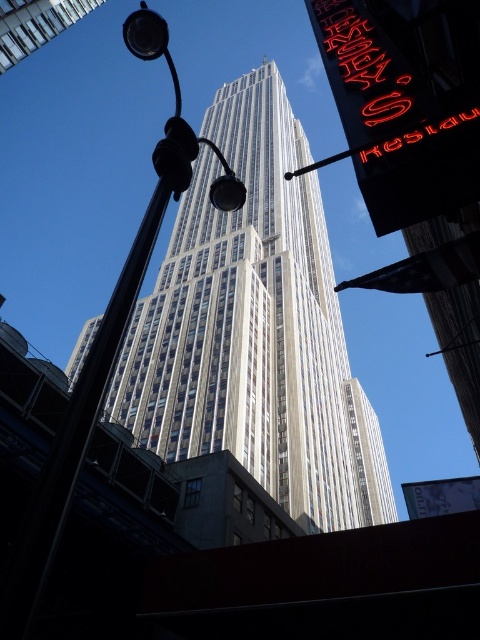
Does white glass skyscraper at center have a larger size compared to metallic streetlight at center?

Yes.

Measure the distance between white glass skyscraper at center and camera.

A distance of 71.25 meters exists between white glass skyscraper at center and camera.

Identify the location of white glass skyscraper at center. The width and height of the screenshot is (480, 640). (254, 330).